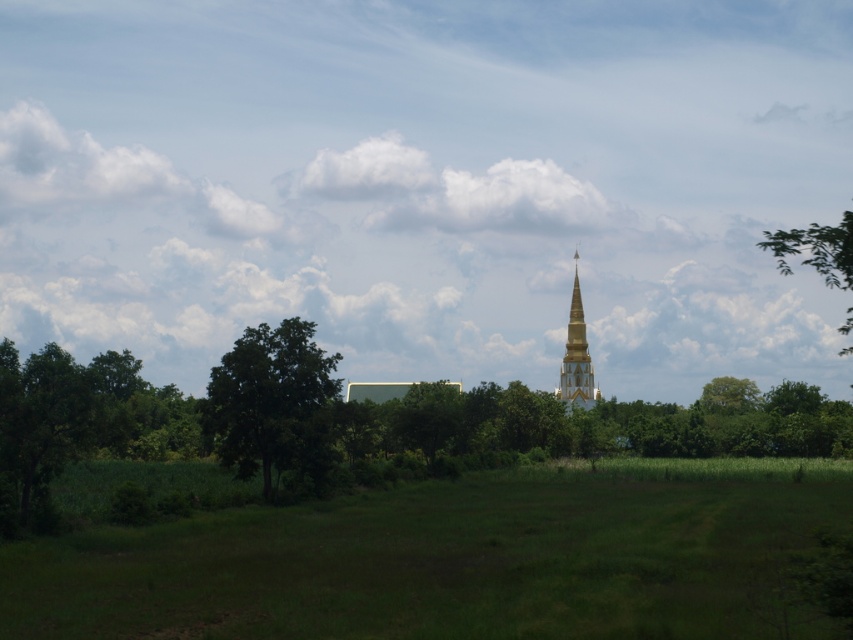
Who is more distant from viewer, (840, 244) or (567, 380)?

The point (567, 380) is behind.

In the scene shown: Does green leafy tree at upper right have a lesser width compared to gold metallic stupa at center?

In fact, green leafy tree at upper right might be wider than gold metallic stupa at center.

Who is more distant from viewer, (762, 241) or (563, 394)?

Positioned behind is point (762, 241).

Where is `green leafy tree at upper right`? The height and width of the screenshot is (640, 853). green leafy tree at upper right is located at coordinates (816, 250).

Between green leafy tree at left and green leafy tree at upper right, which one is positioned higher?

green leafy tree at upper right is above.

Can you confirm if green leafy tree at left is shorter than green leafy tree at upper right?

Correct, green leafy tree at left is not as tall as green leafy tree at upper right.

Find the location of a particular element. green leafy tree at left is located at coordinates (273, 403).

What do you see at coordinates (273, 403) in the screenshot?
I see `green leafy tree at left` at bounding box center [273, 403].

Which of these two, green leafy tree at left or gold metallic stupa at center, stands taller?

gold metallic stupa at center is taller.

Does point (321, 470) lie in front of point (572, 397)?

Yes, it is.

I want to click on green leafy tree at left, so click(273, 403).